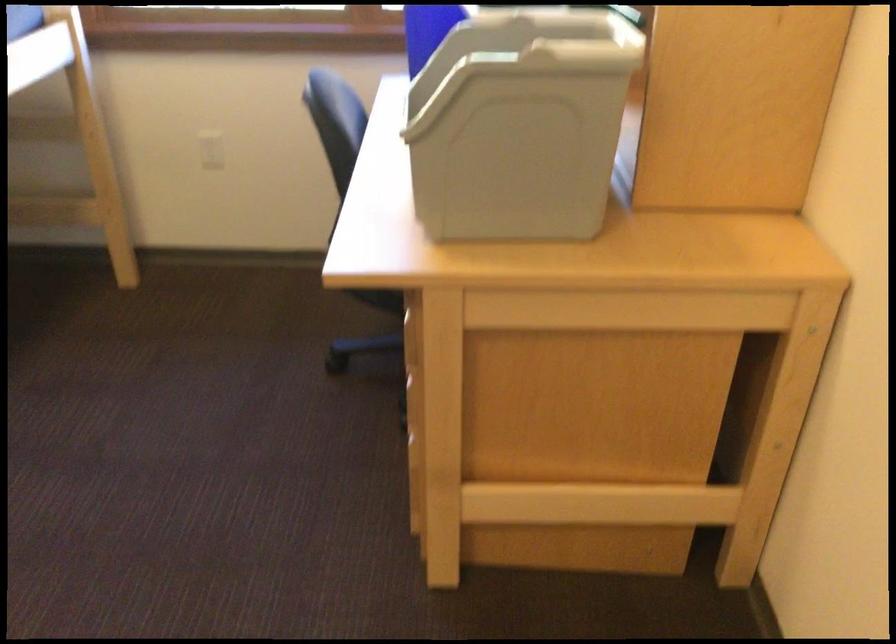
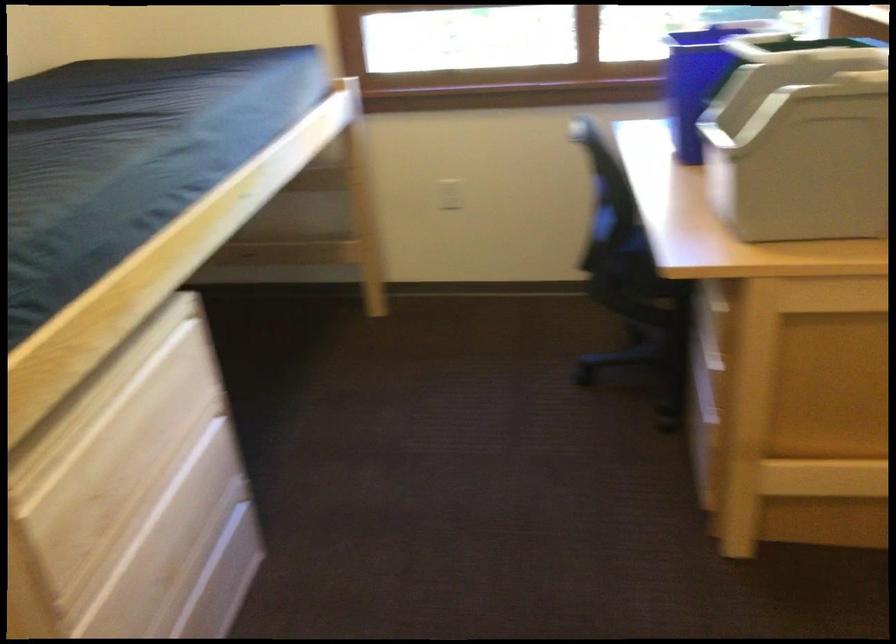
What movement of the cameraman would produce the second image?

The movement direction of the cameraman is left, backward.